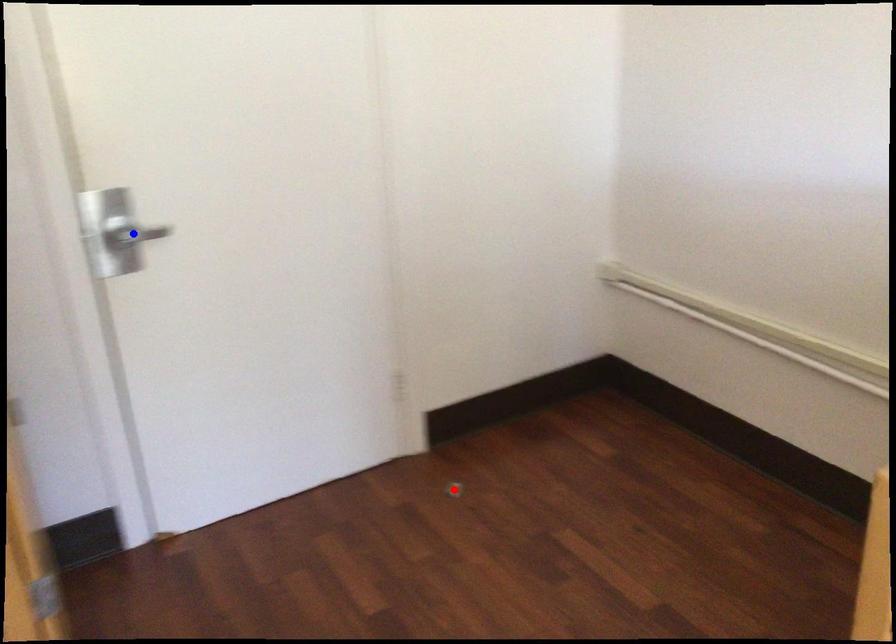
Question: Two points are marked on the image. Which point is closer to the camera?

Choices:
 (A) Blue point is closer.
 (B) Red point is closer.

Answer: (A)